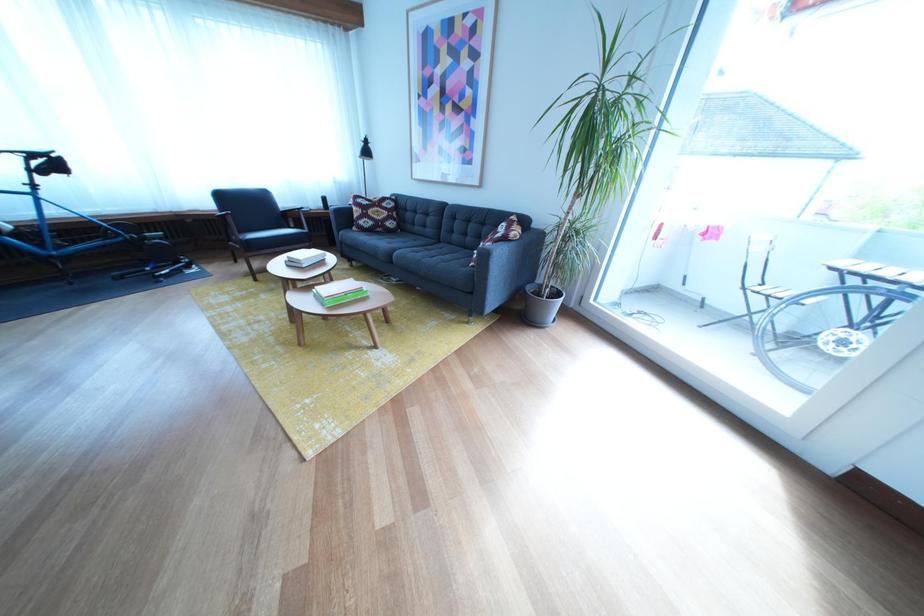
Where would you sit the bike saddle? Please return your answer as a coordinate pair (x, y).

(42, 161)